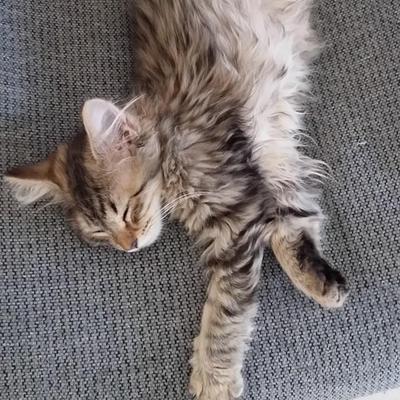
Image resolution: width=400 pixels, height=400 pixels. What are the coordinates of `carpet or rug the cat is laying on` in the screenshot? It's located at (364, 83), (56, 44).